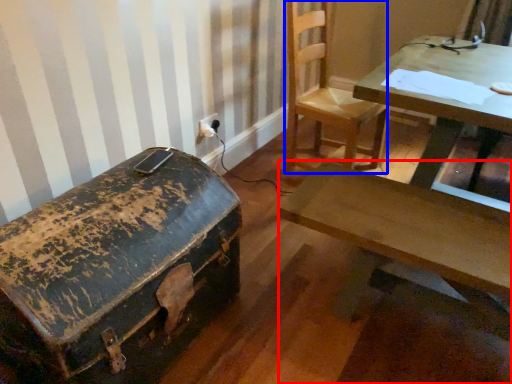
Question: Which point is closer to the camera, desk (highlighted by a red box) or chair (highlighted by a blue box)?

Choices:
 (A) desk
 (B) chair

Answer: (A)